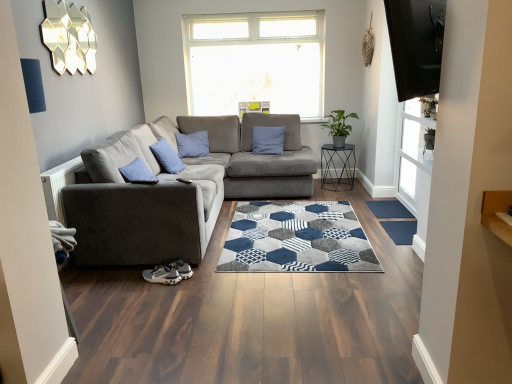
What do you see at coordinates (388, 209) in the screenshot? I see `blue textured mat at lower right` at bounding box center [388, 209].

Looking at this image, measure the distance between point (x=384, y=205) and camera.

Point (x=384, y=205) and camera are 4.32 meters apart.

Measure the distance between point (180, 171) and camera.

Point (180, 171) and camera are 4.04 meters apart.

Find the location of a particular element. This screenshot has height=384, width=512. blue textured mat at lower right is located at coordinates (388, 209).

Does point (352, 169) come behind point (168, 157)?

That is True.

Is metallic black side table at center-right positioned with its back to blue cotton pillow at center?

metallic black side table at center-right does not have its back to blue cotton pillow at center.

Looking at this image, considering the sizes of metallic black side table at center-right and blue cotton pillow at center in the image, is metallic black side table at center-right wider or thinner than blue cotton pillow at center?

Considering their sizes, metallic black side table at center-right looks broader than blue cotton pillow at center.

Considering the sizes of suede gray couch at left and blue textured mat at lower right in the image, is suede gray couch at left wider or thinner than blue textured mat at lower right?

Considering their sizes, suede gray couch at left looks broader than blue textured mat at lower right.

Is the position of suede gray couch at left less distant than that of blue textured mat at lower right?

Yes, it is in front of blue textured mat at lower right.

In the scene shown: Between suede gray couch at left and blue textured mat at lower right, which one has larger size?

suede gray couch at left is bigger.

Are suede gray couch at left and blue textured mat at lower right beside each other?

No.

From a real-world perspective, is metallic black side table at center-right physically located above or below dark blue textured mat at lower right?

metallic black side table at center-right is above dark blue textured mat at lower right.

Considering the relative sizes of metallic black side table at center-right and dark blue textured mat at lower right in the image provided, is metallic black side table at center-right thinner than dark blue textured mat at lower right?

No.

Is metallic black side table at center-right facing towards dark blue textured mat at lower right?

Yes, metallic black side table at center-right is aimed at dark blue textured mat at lower right.

Locate an element on the screen. Image resolution: width=512 pixels, height=384 pixels. mat that appears below the metallic black side table at center-right (from a real-world perspective) is located at coordinates (400, 231).

Can you confirm if metallic black side table at center-right is taller than suede gray couch at left?

No, metallic black side table at center-right is not taller than suede gray couch at left.

Would you say metallic black side table at center-right is outside suede gray couch at left?

metallic black side table at center-right is positioned outside suede gray couch at left.

Does metallic black side table at center-right appear on the right side of suede gray couch at left?

Indeed, metallic black side table at center-right is positioned on the right side of suede gray couch at left.

From the image's perspective, which one is positioned higher, metallic black side table at center-right or suede gray couch at left?

metallic black side table at center-right is shown above in the image.

Is suede gray couch at left behind blue cotton pillow at center?

No, suede gray couch at left is closer to the camera.

Which of these two, suede gray couch at left or blue cotton pillow at center, is bigger?

suede gray couch at left is bigger.

From a real-world perspective, relative to blue cotton pillow at center, is suede gray couch at left vertically above or below?

In terms of real-world spatial position, suede gray couch at left is below blue cotton pillow at center.

Is suede gray couch at left positioned far away from metallic black side table at center-right?

That's right, there is a large distance between suede gray couch at left and metallic black side table at center-right.

Between point (287, 195) and point (345, 151), which one is positioned behind?

The point (345, 151) is behind.

Is suede gray couch at left oriented towards metallic black side table at center-right?

Yes, suede gray couch at left is facing metallic black side table at center-right.

Which of these two, suede gray couch at left or metallic black side table at center-right, is wider?

suede gray couch at left is wider.

Considering the positions of objects dark blue textured mat at lower right and blue cotton pillow at center in the image provided, who is behind, dark blue textured mat at lower right or blue cotton pillow at center?

blue cotton pillow at center is behind.

Which is more to the right, dark blue textured mat at lower right or blue cotton pillow at center?

Positioned to the right is dark blue textured mat at lower right.

Which of these two, dark blue textured mat at lower right or blue cotton pillow at center, stands taller?

With more height is blue cotton pillow at center.

Does dark blue textured mat at lower right contain blue cotton pillow at center?

Definitely not — blue cotton pillow at center is not inside dark blue textured mat at lower right.

Where is `table behind the blue cotton pillow at center`? Image resolution: width=512 pixels, height=384 pixels. table behind the blue cotton pillow at center is located at coordinates (337, 167).

This screenshot has height=384, width=512. Find the location of `flat that is under the suede gray couch at left (from a real-world perspective)`. flat that is under the suede gray couch at left (from a real-world perspective) is located at coordinates [x=388, y=209].

Which object lies nearer to the anchor point dark blue textured mat at lower right, blue textured mat at lower right or metallic black side table at center-right?

blue textured mat at lower right is positioned closer to the anchor dark blue textured mat at lower right.

Which object lies further to the anchor point dark blue textured mat at lower right, suede gray couch at left or blue textured mat at lower right?

suede gray couch at left.

When comparing their distances from blue cotton pillow at center, does metallic black side table at center-right or suede gray couch at left seem further?

metallic black side table at center-right.

Based on their spatial positions, is metallic black side table at center-right or blue textured mat at lower right further from suede gray couch at left?

Among the two, blue textured mat at lower right is located further to suede gray couch at left.

From the image, which object appears to be nearer to blue textured mat at lower right, blue cotton pillow at center or metallic black side table at center-right?

metallic black side table at center-right is closer to blue textured mat at lower right.

Estimate the real-world distances between objects in this image. Which object is closer to metallic black side table at center-right, dark blue textured mat at lower right or blue textured mat at lower right?

blue textured mat at lower right is positioned closer to the anchor metallic black side table at center-right.

Which object lies nearer to the anchor point blue textured mat at lower right, suede gray couch at left or dark blue textured mat at lower right?

Among the two, dark blue textured mat at lower right is located nearer to blue textured mat at lower right.

When comparing their distances from dark blue textured mat at lower right, does metallic black side table at center-right or blue cotton pillow at center seem closer?

metallic black side table at center-right is closer to dark blue textured mat at lower right.

You are a GUI agent. You are given a task and a screenshot of the screen. Output one action in this format:
    pyautogui.click(x=<x>, y=<y>)
    Task: Click on the flat between dark blue textured mat at lower right and metallic black side table at center-right in the front-back direction
    This screenshot has width=512, height=384.
    Given the screenshot: What is the action you would take?
    pyautogui.click(x=388, y=209)

The height and width of the screenshot is (384, 512). In order to click on mat between blue cotton pillow at center and blue textured mat at lower right in this screenshot , I will do `click(400, 231)`.

I want to click on flat between suede gray couch at left and metallic black side table at center-right from front to back, so click(x=388, y=209).

Locate an element on the screen. This screenshot has height=384, width=512. studio couch between blue cotton pillow at center and blue textured mat at lower right from left to right is located at coordinates (178, 188).